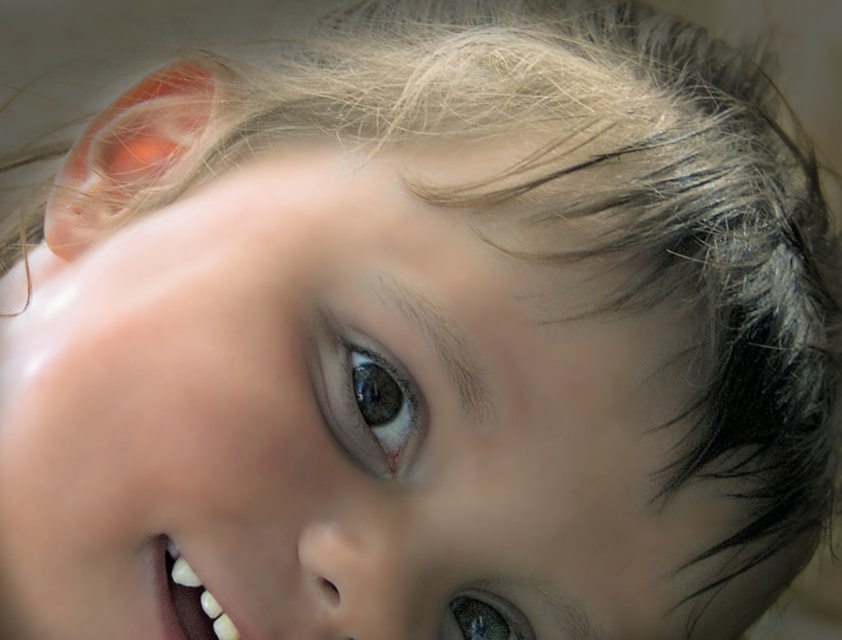
Question: Is brown glossy eye at center below shiny brown eye at lower center?

Choices:
 (A) yes
 (B) no

Answer: (B)

Question: Estimate the real-world distances between objects in this image. Which object is farther from the shiny brown eye at lower center?

Choices:
 (A) white glossy teeth at lower left
 (B) brown glossy eye at center

Answer: (A)

Question: Among these objects, which one is farthest from the camera?

Choices:
 (A) brown glossy eye at center
 (B) shiny brown eye at lower center
 (C) white glossy teeth at lower left

Answer: (B)

Question: Can you confirm if brown glossy eye at center is wider than shiny brown eye at lower center?

Choices:
 (A) yes
 (B) no

Answer: (A)

Question: Which of the following is the farthest from the observer?

Choices:
 (A) white glossy teeth at lower left
 (B) brown glossy eye at center

Answer: (B)

Question: Is brown glossy eye at center thinner than shiny brown eye at lower center?

Choices:
 (A) yes
 (B) no

Answer: (B)